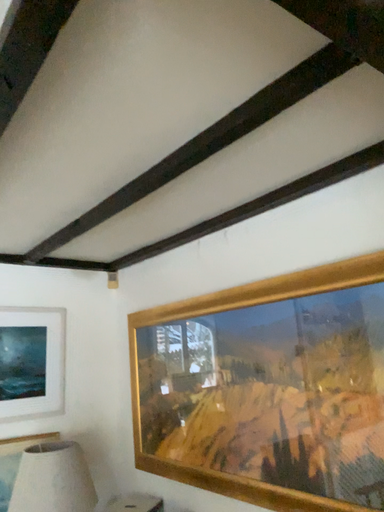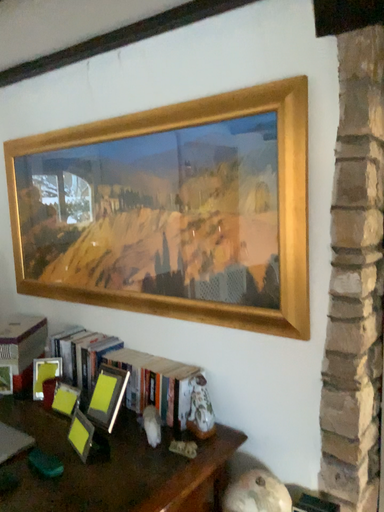
Question: How did the camera likely rotate when shooting the video?

Choices:
 (A) rotated right
 (B) rotated left

Answer: (A)